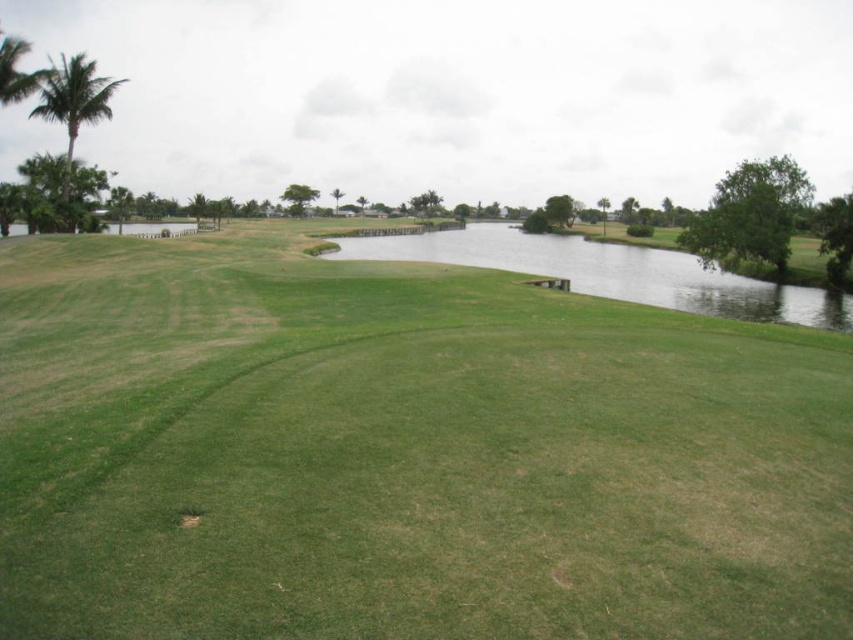
Which is below, green grassy lake at center or green leafy palm tree at upper left?

green grassy lake at center is lower down.

Who is shorter, green grassy lake at center or green leafy palm tree at upper left?

green grassy lake at center is shorter.

Is point (624, 278) behind point (91, 97)?

No, it is not.

Where is `green grassy lake at center`? This screenshot has height=640, width=853. green grassy lake at center is located at coordinates (611, 273).

Which is more to the right, green grassy golf course at center or green grassy lake at center?

Positioned to the right is green grassy lake at center.

Does green grassy golf course at center have a greater width compared to green grassy lake at center?

In fact, green grassy golf course at center might be narrower than green grassy lake at center.

What do you see at coordinates (403, 454) in the screenshot? This screenshot has height=640, width=853. I see `green grassy golf course at center` at bounding box center [403, 454].

You are a GUI agent. You are given a task and a screenshot of the screen. Output one action in this format:
    pyautogui.click(x=<x>, y=<y>)
    Task: Click on the green grassy golf course at center
    The height and width of the screenshot is (640, 853).
    Given the screenshot: What is the action you would take?
    pyautogui.click(x=403, y=454)

Who is more distant from viewer, (735, 515) or (65, 72)?

Point (65, 72)

Which is in front, point (126, 364) or point (39, 88)?

Positioned in front is point (126, 364).

Does point (505, 518) come farther from viewer compared to point (59, 115)?

No, (505, 518) is in front of (59, 115).

Find the location of a particular element. green grassy golf course at center is located at coordinates (403, 454).